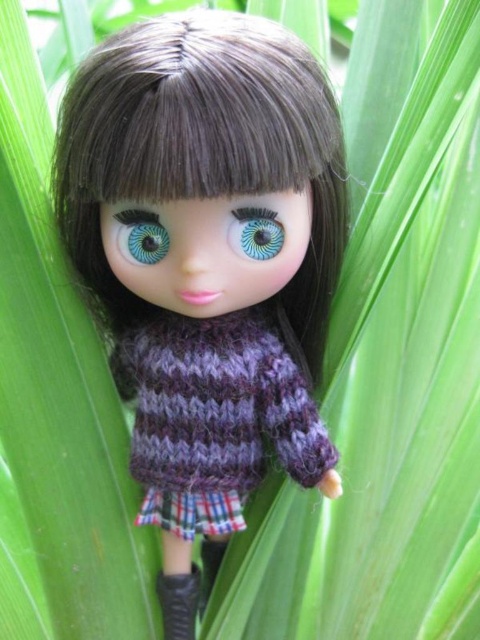
You are a fashion designer trying to create a pair of boots that match the doll. The boots must be the same width as the blue glossy eye at center. Can the existing black leather boot at lower center be used as a template? Please explain.

The black leather boot at lower center is wider than the blue glossy eye at center. Therefore, the existing boot cannot be used as a template since its width exceeds the required size.

You are a toy repair technician who needs to fix the doll. You have a 6.5 inch long tool. Can you reach from the knitted purple sweater at center to the blue glossy eye at center with your tool?

The distance between the knitted purple sweater at center and the blue glossy eye at center is 7.12 inches. Since the tool is only 6.5 inches long, it is not long enough to reach from the knitted purple sweater at center to the blue glossy eye at center.

You are a fashion designer looking at the doll in the image. You need to determine the placement of the knitted purple sweater at center and the blue glossy eye at center. Which object is located to the right of the other?

The knitted purple sweater at center is positioned on the right side of blue glossy eye at center.